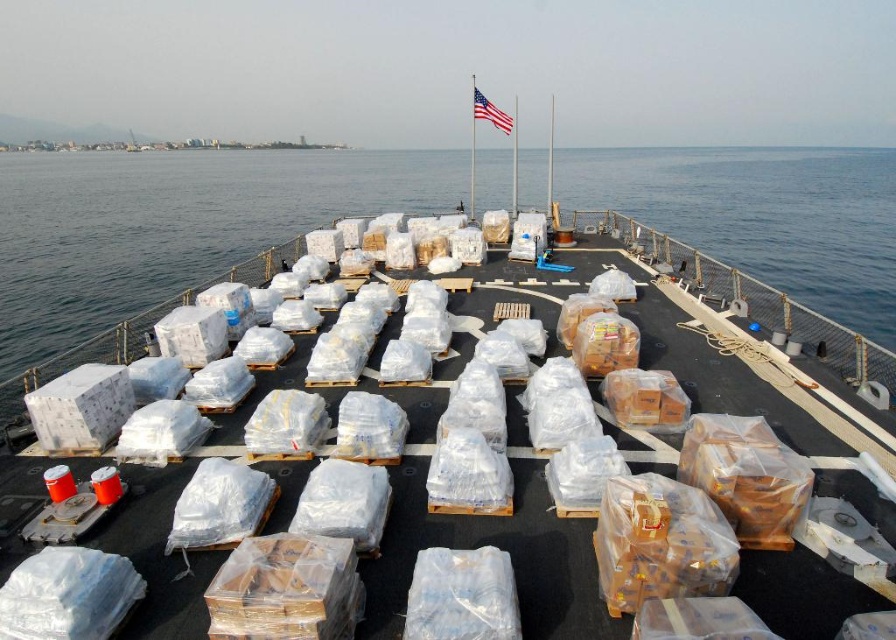
You are a cargo inspector on the ship deck. You need to determine if there is enough space to place an additional large crate next to the clear plastic packages at center. Considering the space taken by the american flag at center, can you fit the crate there?

The clear plastic packages at center occupies less space than american flag at center, so there might be enough space next to the clear plastic packages at center if the crate is smaller than the remaining area not occupied by the american flag at center.

You are a cargo inspector on the ship deck. You notice the clear plastic packages at center and the transparent plastic pallets at center. Which one is closer to you as you stand on the deck?

The clear plastic packages at center are closer to you since they are positioned in front of the transparent plastic pallets at center.